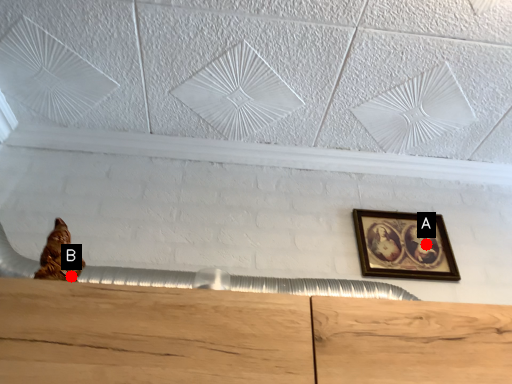
Question: Two points are circled on the image, labeled by A and B beside each circle. Which point appears farthest from the camera in this image?

Choices:
 (A) A is further
 (B) B is further

Answer: (A)